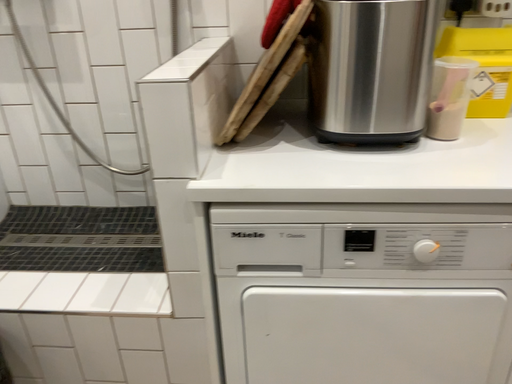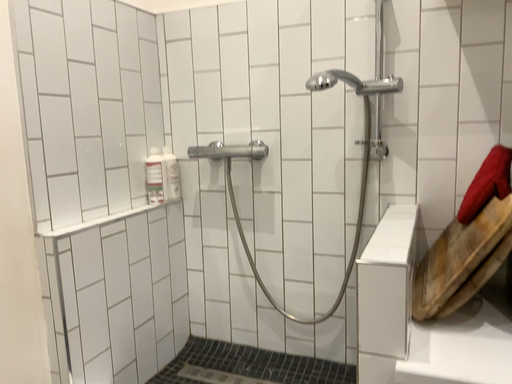
Question: Which way did the camera rotate in the video?

Choices:
 (A) rotated left
 (B) rotated right

Answer: (A)